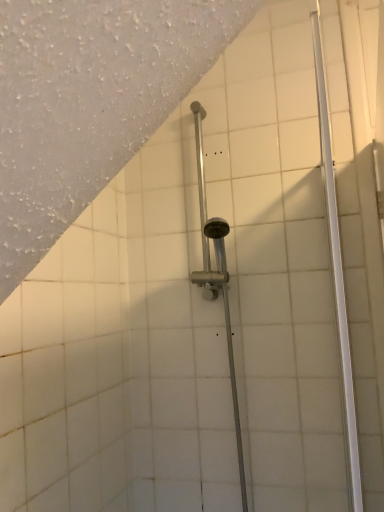
Image resolution: width=384 pixels, height=512 pixels. What do you see at coordinates (337, 274) in the screenshot? I see `white glossy shower at right` at bounding box center [337, 274].

In order to face white glossy shower at right, should I rotate leftwards or rightwards?

Rotate right and turn 19.069 degrees.

You are a GUI agent. You are given a task and a screenshot of the screen. Output one action in this format:
    pyautogui.click(x=<x>, y=<y>)
    Task: Click on the white glossy shower at right
    The image size is (384, 512).
    Given the screenshot: What is the action you would take?
    pyautogui.click(x=337, y=274)

This screenshot has height=512, width=384. I want to click on white glossy shower at right, so click(x=337, y=274).